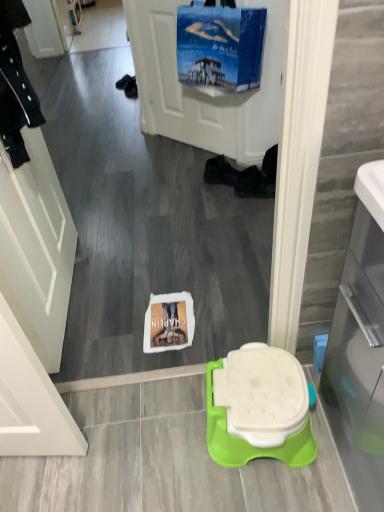
This screenshot has width=384, height=512. In order to click on vacant area in front of black fabric shoe at center, which is the second footwear from right to left in this screenshot , I will do `click(213, 197)`.